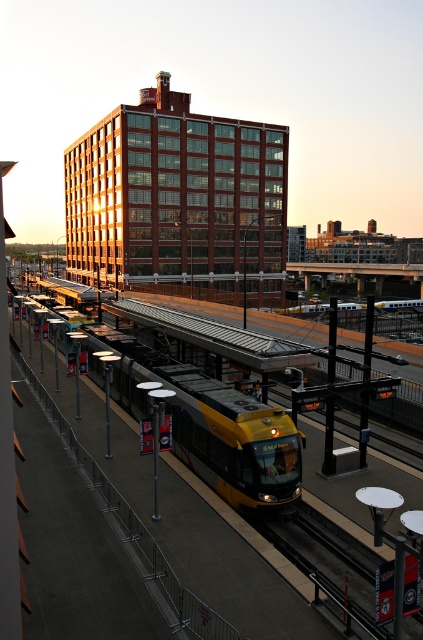
Question: Which object appears closest to the camera in this image?

Choices:
 (A) metallic smooth train track at lower center
 (B) yellow metallic train at center

Answer: (A)

Question: Can you confirm if yellow metallic train at center is positioned above metallic smooth train track at lower center?

Choices:
 (A) yes
 (B) no

Answer: (A)

Question: Which point appears farthest from the camera in this image?

Choices:
 (A) (225, 433)
 (B) (252, 520)

Answer: (A)

Question: Can you confirm if yellow metallic train at center is positioned below metallic smooth train track at lower center?

Choices:
 (A) yes
 (B) no

Answer: (B)

Question: Which object appears closest to the camera in this image?

Choices:
 (A) metallic smooth train track at lower center
 (B) yellow metallic train at center

Answer: (A)

Question: From the image, what is the correct spatial relationship of yellow metallic train at center in relation to metallic smooth train track at lower center?

Choices:
 (A) right
 (B) left

Answer: (B)